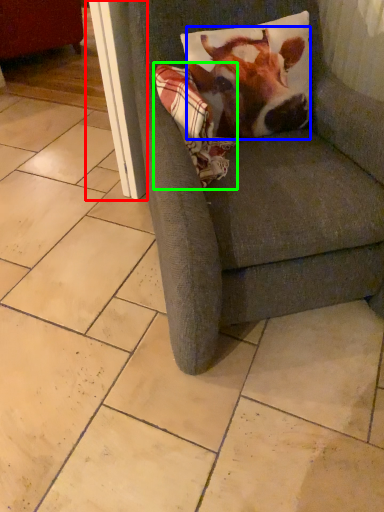
Question: Considering the real-world distances, which object is farthest from screen door (highlighted by a red box)? cattle (highlighted by a blue box) or blanket (highlighted by a green box)?

Choices:
 (A) cattle
 (B) blanket

Answer: (A)